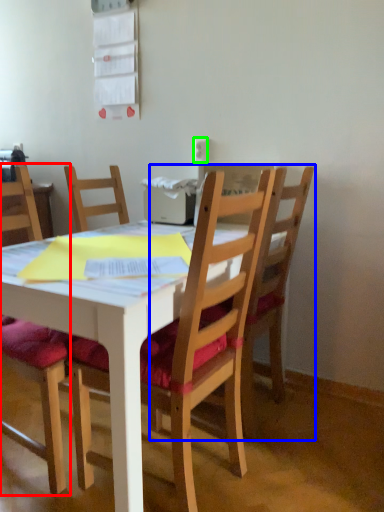
Question: Which object is positioned farthest from chair (highlighted by a red box)? Select from chair (highlighted by a blue box) and power outlet (highlighted by a green box).

Choices:
 (A) chair
 (B) power outlet

Answer: (B)